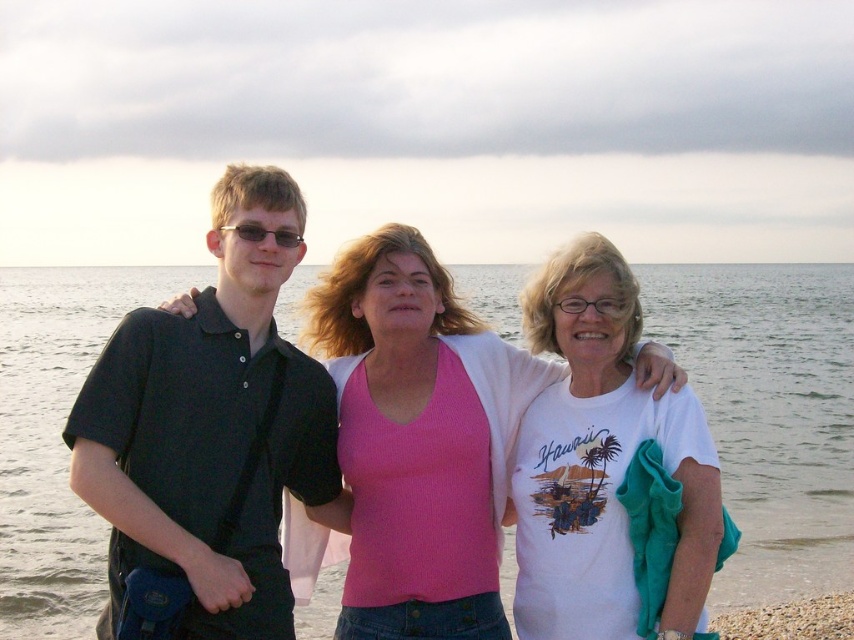
Question: Can you confirm if clear water at center is positioned to the right of black matte shirt at left?

Choices:
 (A) yes
 (B) no

Answer: (A)

Question: Is black matte shirt at left in front of pink ribbed tank top at center?

Choices:
 (A) yes
 (B) no

Answer: (A)

Question: Which point is closer to the camera?

Choices:
 (A) white cotton shirt at center
 (B) pink ribbed tank top at center

Answer: (A)

Question: Can you confirm if black matte shirt at left is wider than white cotton shirt at center?

Choices:
 (A) no
 (B) yes

Answer: (B)

Question: Which of the following is the closest to the observer?

Choices:
 (A) pyautogui.click(x=477, y=276)
 (B) pyautogui.click(x=471, y=572)
 (C) pyautogui.click(x=611, y=262)

Answer: (C)

Question: Which point is closer to the camera?

Choices:
 (A) clear water at center
 (B) white cotton shirt at center
 (C) pink ribbed tank top at center

Answer: (A)